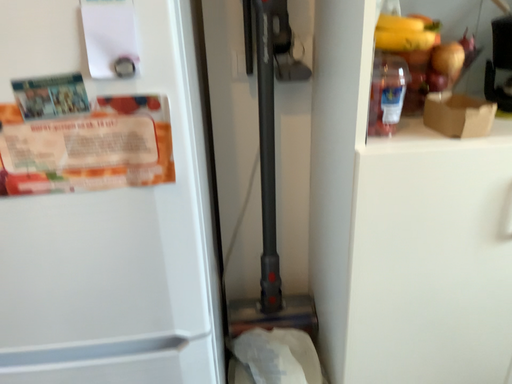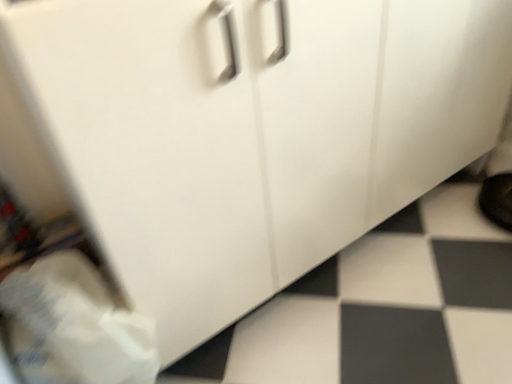
Question: Which way did the camera rotate in the video?

Choices:
 (A) rotated upward
 (B) rotated downward

Answer: (B)